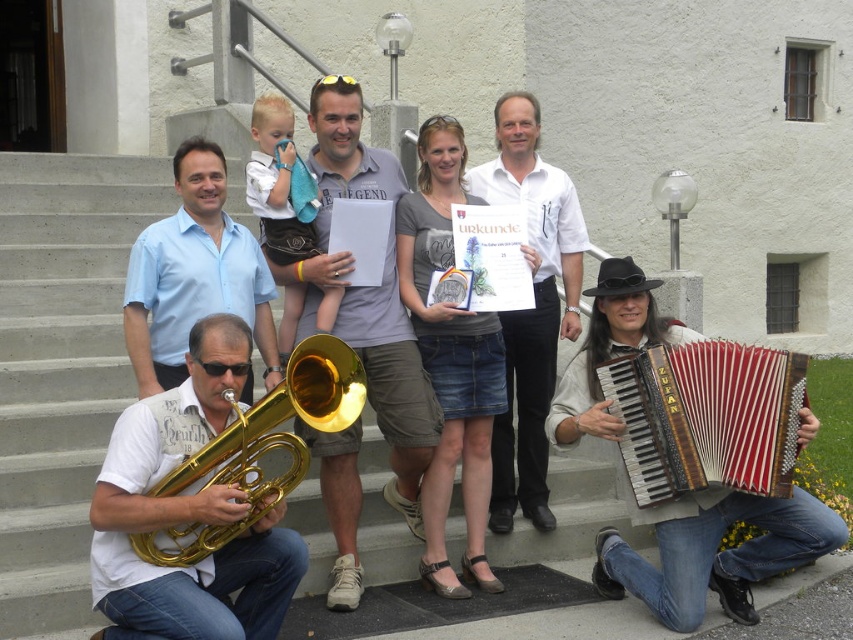
Question: Which point appears closest to the camera in this image?

Choices:
 (A) (335, 486)
 (B) (683, 397)
 (C) (576, 240)

Answer: (B)

Question: Considering the real-world distances, which object is closest to the gold brass tuba at lower left?

Choices:
 (A) white cotton shirt at center
 (B) gold brass tuba at center
 (C) matte blue shirt at center
 (D) wooden/leather accordion at lower right

Answer: (C)

Question: Is gold brass tuba at center smaller than wooden/leather accordion at lower right?

Choices:
 (A) no
 (B) yes

Answer: (A)

Question: Where is wooden/leather accordion at lower right located in relation to gold brass tuba at lower left in the image?

Choices:
 (A) left
 (B) right

Answer: (B)

Question: Is white cotton shirt at center positioned before gold brass tuba at lower left?

Choices:
 (A) yes
 (B) no

Answer: (B)

Question: Which point is closer to the camera taking this photo?

Choices:
 (A) (575, 292)
 (B) (788, 467)
 (C) (161, 337)

Answer: (B)